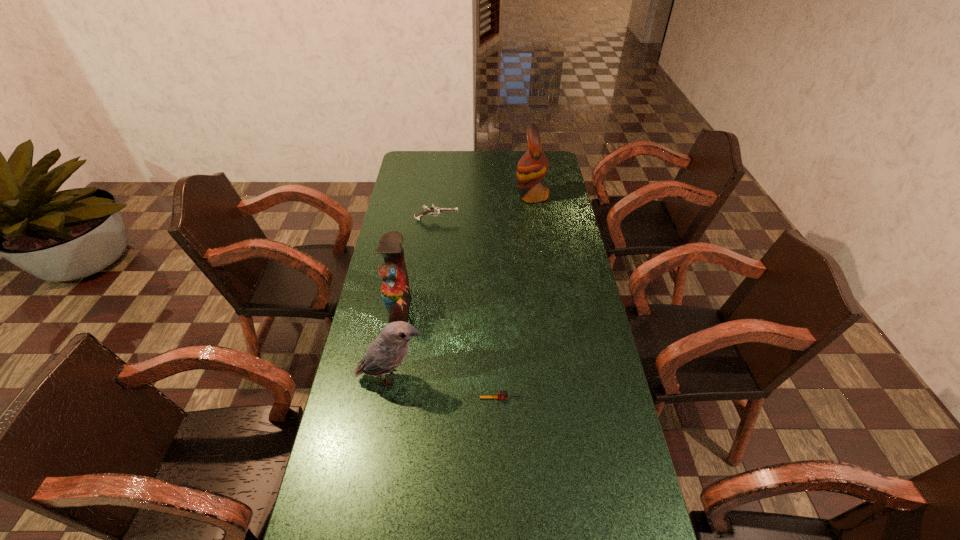
The image size is (960, 540). Find the location of `free space located on the face of the tallest object`. free space located on the face of the tallest object is located at coordinates (488, 196).

This screenshot has height=540, width=960. What are the coordinates of `vacant space located 0.250m at the face of the third farthest object` in the screenshot? It's located at (482, 306).

The image size is (960, 540). Find the location of `vacant space located on the front-facing side of the nearest parrot`. vacant space located on the front-facing side of the nearest parrot is located at coordinates (508, 377).

You are a GUI agent. You are given a task and a screenshot of the screen. Output one action in this format:
    pyautogui.click(x=<x>, y=<y>)
    Task: Click on the vacant region located 0.350m aimed along the barrel of the gun
    This screenshot has height=540, width=960.
    Given the screenshot: What is the action you would take?
    pyautogui.click(x=538, y=220)

You are a GUI agent. You are given a task and a screenshot of the screen. Output one action in this format:
    pyautogui.click(x=<x>, y=<y>)
    Task: Click on the free space located on the right of the fourth object from left to right
    Image resolution: width=960 pixels, height=540 pixels.
    Given the screenshot: What is the action you would take?
    pyautogui.click(x=547, y=398)

Locate an element on the screen. gun situated at the left edge is located at coordinates (435, 210).

The image size is (960, 540). I want to click on object located in the right edge section of the desktop, so click(x=533, y=165).

The height and width of the screenshot is (540, 960). I want to click on free location at the far edge of the desktop, so click(x=510, y=153).

In order to click on free space at the left edge of the desktop in this screenshot , I will do `click(397, 220)`.

Locate an element on the screen. Image resolution: width=960 pixels, height=540 pixels. vacant space at the right edge is located at coordinates (545, 288).